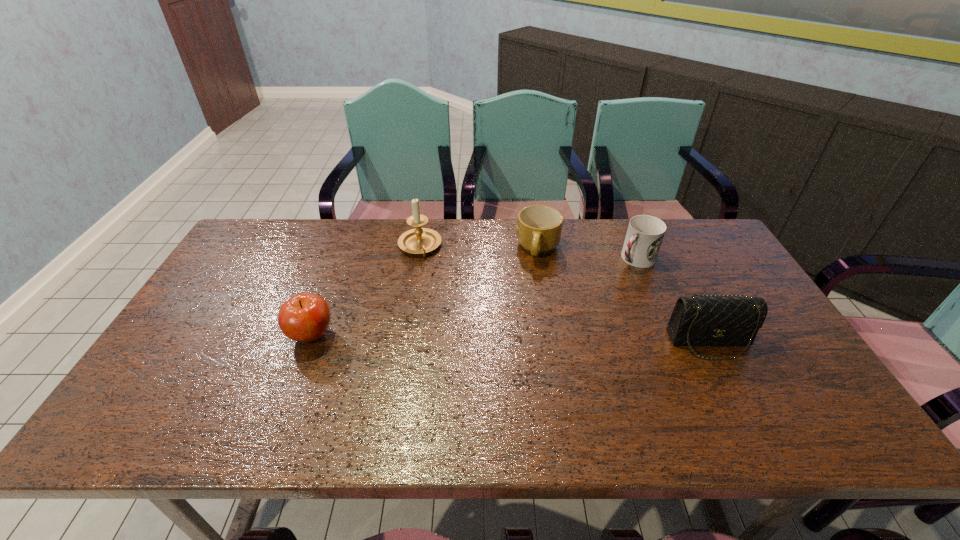
Image resolution: width=960 pixels, height=540 pixels. I want to click on object present at the right edge, so click(717, 320).

This screenshot has width=960, height=540. In the image, there is a desktop. What are the coordinates of `vacant space at the far edge` in the screenshot? It's located at click(437, 253).

You are a GUI agent. You are given a task and a screenshot of the screen. Output one action in this format:
    pyautogui.click(x=<x>, y=<y>)
    Task: Click on the vacant space at the near edge
    The image size is (960, 540).
    Given the screenshot: What is the action you would take?
    pyautogui.click(x=680, y=393)

In the image, there is a desktop. Identify the location of vacant space at the left edge. This screenshot has width=960, height=540. (199, 335).

Identify the location of vacant space at the far left corner of the desktop. This screenshot has width=960, height=540. (300, 224).

You are a GUI agent. You are given a task and a screenshot of the screen. Output one action in this format:
    pyautogui.click(x=<x>, y=<y>)
    Task: Click on the vacant point located between the clutch bag and the leftmost object
    
    Given the screenshot: What is the action you would take?
    pyautogui.click(x=511, y=339)

Where is `vacant area that lies between the clutch bag and the candle holder`? vacant area that lies between the clutch bag and the candle holder is located at coordinates (564, 294).

The height and width of the screenshot is (540, 960). What are the coordinates of `free space between the leftmost object and the clutch bag` in the screenshot? It's located at (511, 339).

Find the location of `vacant region between the third object from left to right and the cup`. vacant region between the third object from left to right and the cup is located at coordinates (587, 254).

The width and height of the screenshot is (960, 540). Find the location of `free space between the clutch bag and the cup`. free space between the clutch bag and the cup is located at coordinates (673, 300).